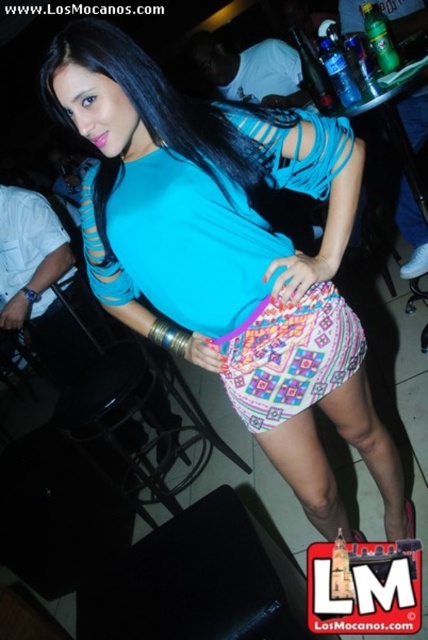
Which is behind, point (407, 529) or point (264, 384)?

Point (407, 529)

Does matte blue top at center have a smaller size compared to turquoise fabric dress at center?

Incorrect, matte blue top at center is not smaller in size than turquoise fabric dress at center.

Measure the distance between point (148, 116) and camera.

A distance of 1.07 meters exists between point (148, 116) and camera.

In order to click on matte blue top at center in this screenshot , I will do `click(196, 198)`.